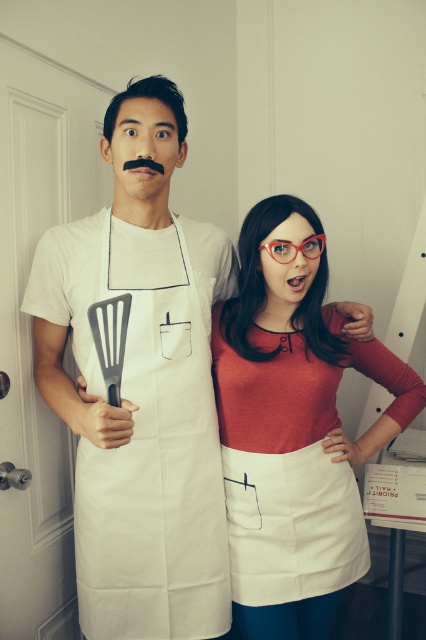
Which of these two, matte white apron at center or white fabric apron at left, stands taller?

matte white apron at center is taller.

This screenshot has width=426, height=640. What do you see at coordinates (293, 428) in the screenshot?
I see `matte white apron at center` at bounding box center [293, 428].

Looking at this image, measure the distance between point (319, 304) and camera.

Point (319, 304) is 1.42 meters away from camera.

Locate an element on the screen. This screenshot has height=640, width=426. matte white apron at center is located at coordinates (293, 428).